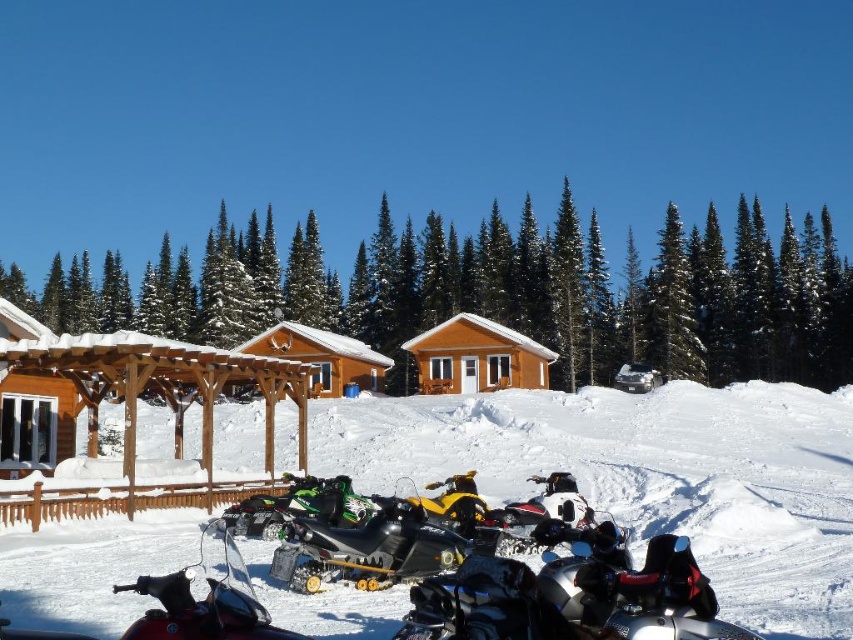
Question: Is shiny metallic snowmobile at center above green matte snowmobile at center?

Choices:
 (A) yes
 (B) no

Answer: (A)

Question: Which point is closer to the camera?

Choices:
 (A) (351, 344)
 (B) (511, 566)
 (C) (322, 579)

Answer: (B)

Question: Is matte black snowmobile at lower center positioned before matte wood cabin at center?

Choices:
 (A) yes
 (B) no

Answer: (A)

Question: Is shiny silver snowmobile at lower center below shiny metallic snowmobile at center?

Choices:
 (A) no
 (B) yes

Answer: (A)

Question: Which object is the closest to the wooden ski slope at center?

Choices:
 (A) matte black snowmobile at lower center
 (B) brown wooden cabin at center

Answer: (B)

Question: Which point is closer to the camera?

Choices:
 (A) (537, 349)
 (B) (161, 630)
 (C) (259, 493)
 (D) (355, 532)

Answer: (B)